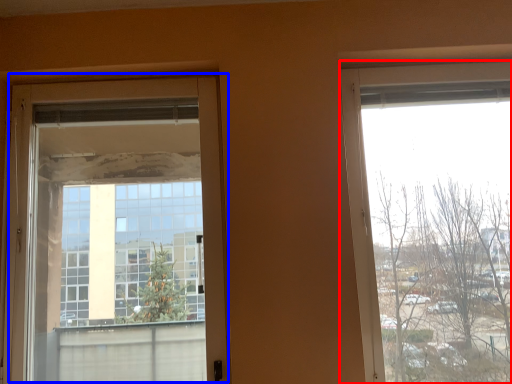
Question: Among these objects, which one is nearest to the camera, window (highlighted by a red box) or door (highlighted by a blue box)?

Choices:
 (A) window
 (B) door

Answer: (A)